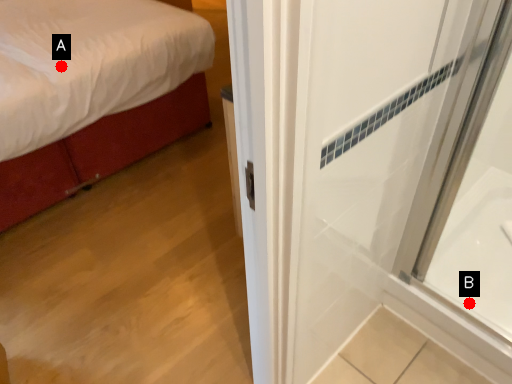
Question: Two points are circled on the image, labeled by A and B beside each circle. Which point is closer to the camera?

Choices:
 (A) A is closer
 (B) B is closer

Answer: (B)